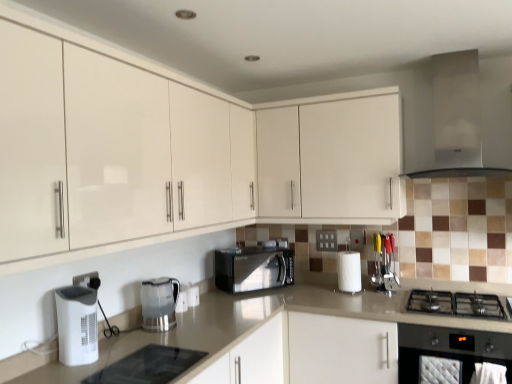
This screenshot has height=384, width=512. What are the coordinates of `satin silver exhaust hood at upper right` in the screenshot? It's located at (458, 114).

What do you see at coordinates (147, 366) in the screenshot? I see `black glass cooktop at lower center, acting as the 1th appliance starting from the bottom` at bounding box center [147, 366].

Describe the element at coordinates (77, 325) in the screenshot. This screenshot has width=512, height=384. I see `white plastic air purifier at lower left, which appears as the 2th kitchen appliance when viewed from the back` at that location.

Describe the element at coordinates (159, 303) in the screenshot. I see `clear plastic kettle at center, arranged as the 1th kitchen appliance when viewed from the right` at that location.

What are the coordinates of `black matte gas stove at lower right` in the screenshot? It's located at (449, 349).

What do you see at coordinates (87, 280) in the screenshot? I see `white plastic electric outlet at lower center, which is the 2th electric outlet in back-to-front order` at bounding box center [87, 280].

The image size is (512, 384). I want to click on satin silver exhaust hood at upper right, so click(458, 114).

Considering the points (157, 374) and (179, 222), which point is behind, point (157, 374) or point (179, 222)?

The point (179, 222) is farther from the camera.

Considering the sizes of black glass cooktop at lower center, the second appliance positioned from the back, and matte white cabinets at center, the 1th cabinetry from the front, in the image, is black glass cooktop at lower center, the second appliance positioned from the back, wider or thinner than matte white cabinets at center, the 1th cabinetry from the front,?

Considering their sizes, black glass cooktop at lower center, the second appliance positioned from the back, looks slimmer than matte white cabinets at center, the 1th cabinetry from the front.

Who is bigger, black glass cooktop at lower center, positioned as the second appliance in top-to-bottom order, or matte white cabinets at center, the 1th cabinetry from the front?

matte white cabinets at center, the 1th cabinetry from the front, is bigger.

In the image, is black glass cooktop at lower center, positioned as the 1th appliance in left-to-right order, positioned in front of or behind matte white cabinets at center, which is counted as the second cabinetry, starting from the back?

black glass cooktop at lower center, positioned as the 1th appliance in left-to-right order, is behind matte white cabinets at center, which is counted as the second cabinetry, starting from the back.

Could you tell me if black glass cooktop at lower center, the second appliance positioned from the back, is turned towards clear plastic kettle at center, arranged as the 1th kitchen appliance when viewed from the right?

No, black glass cooktop at lower center, the second appliance positioned from the back, is not turned towards clear plastic kettle at center, arranged as the 1th kitchen appliance when viewed from the right.

Is black glass cooktop at lower center, marked as the second appliance in a right-to-left arrangement, not inside clear plastic kettle at center, the 2th kitchen appliance when ordered from left to right?

Yes, black glass cooktop at lower center, marked as the second appliance in a right-to-left arrangement, is located beyond the bounds of clear plastic kettle at center, the 2th kitchen appliance when ordered from left to right.

Does black glass cooktop at lower center, marked as the second appliance in a right-to-left arrangement, have a lesser width compared to clear plastic kettle at center, arranged as the 1th kitchen appliance when viewed from the right?

Incorrect, the width of black glass cooktop at lower center, marked as the second appliance in a right-to-left arrangement, is not less than that of clear plastic kettle at center, arranged as the 1th kitchen appliance when viewed from the right.

Is black glass cooktop at lower center, acting as the 1th appliance starting from the bottom, directly adjacent to clear plastic kettle at center, which appears as the 1th kitchen appliance when viewed from the back?

No, black glass cooktop at lower center, acting as the 1th appliance starting from the bottom, is not touching clear plastic kettle at center, which appears as the 1th kitchen appliance when viewed from the back.

From a real-world perspective, which object stands above the other?

From a 3D spatial view, white glossy cabinet at upper center, placed as the second cabinetry when sorted from front to back, is above.

In the scene shown: Considering the sizes of objects black glass cooktop at lower center, the second appliance positioned from the back, and white glossy cabinet at upper center, placed as the second cabinetry when sorted from front to back, in the image provided, who is shorter, black glass cooktop at lower center, the second appliance positioned from the back, or white glossy cabinet at upper center, placed as the second cabinetry when sorted from front to back,?

Standing shorter between the two is black glass cooktop at lower center, the second appliance positioned from the back.

Is black glass cooktop at lower center, positioned as the 1th appliance in left-to-right order, thinner than white glossy cabinet at upper center, placed as the second cabinetry when sorted from front to back?

Indeed, black glass cooktop at lower center, positioned as the 1th appliance in left-to-right order, has a lesser width compared to white glossy cabinet at upper center, placed as the second cabinetry when sorted from front to back.

Which is in front, point (154, 355) or point (335, 109)?

The point (154, 355) is in front.

Can we say black matte microwave at center lies outside beige laminate countertop at center?

No, black matte microwave at center is inside beige laminate countertop at center's boundary.

Is beige laminate countertop at center at the back of black matte microwave at center?

That's not correct — black matte microwave at center is not looking away from beige laminate countertop at center.

Considering the relative sizes of black matte microwave at center and beige laminate countertop at center in the image provided, is black matte microwave at center taller than beige laminate countertop at center?

Incorrect, the height of black matte microwave at center is not larger of that of beige laminate countertop at center.

Can you confirm if black matte microwave at center is thinner than beige laminate countertop at center?

Correct, the width of black matte microwave at center is less than that of beige laminate countertop at center.

Based on their positions, is black matte gas stove at lower right located to the left or right of metallic silver utensils at right, which appears as the 2th appliance when viewed from the left?

Based on their positions, black matte gas stove at lower right is located to the right of metallic silver utensils at right, which appears as the 2th appliance when viewed from the left.

Is black matte gas stove at lower right aimed at metallic silver utensils at right, the second appliance in the bottom-to-top sequence?

No, black matte gas stove at lower right is not facing towards metallic silver utensils at right, the second appliance in the bottom-to-top sequence.

Consider the image. Does black matte gas stove at lower right come behind metallic silver utensils at right, arranged as the 1th appliance when viewed from the top?

That is False.

Can you see black matte gas stove at lower right touching metallic silver utensils at right, arranged as the 1th appliance when viewed from the top?

black matte gas stove at lower right is not next to metallic silver utensils at right, arranged as the 1th appliance when viewed from the top, and they're not touching.

From the image's perspective, which one is positioned higher, white plastic electric outlet at center, the first electric outlet in the back-to-front sequence, or black matte microwave at center?

white plastic electric outlet at center, the first electric outlet in the back-to-front sequence, from the image's perspective.

Considering the relative sizes of white plastic electric outlet at center, which is the first electric outlet from right to left, and black matte microwave at center in the image provided, is white plastic electric outlet at center, which is the first electric outlet from right to left, wider than black matte microwave at center?

No, white plastic electric outlet at center, which is the first electric outlet from right to left, is not wider than black matte microwave at center.

How many degrees apart are the facing directions of white plastic electric outlet at center, the first electric outlet in the back-to-front sequence, and black matte microwave at center?

They differ by 49.8 degrees in their facing directions.

At what (x,y) coordinates should I click in order to perform the action: click on microwave oven located underneath the white plastic electric outlet at center, which is counted as the 2th electric outlet, starting from the left (from a real-world perspective). Please return your answer as a coordinate pair (x, y). The width and height of the screenshot is (512, 384). Looking at the image, I should click on (253, 269).

Could you tell me if white plastic electric outlet at lower center, which is the 2th electric outlet in back-to-front order, is facing matte white cabinets at center, which is counted as the second cabinetry, starting from the back?

No, white plastic electric outlet at lower center, which is the 2th electric outlet in back-to-front order, is not oriented towards matte white cabinets at center, which is counted as the second cabinetry, starting from the back.

Measure the distance from white plastic electric outlet at lower center, the 1th electric outlet from the front, to matte white cabinets at center, which is counted as the second cabinetry, starting from the back.

white plastic electric outlet at lower center, the 1th electric outlet from the front, is 37.82 inches away from matte white cabinets at center, which is counted as the second cabinetry, starting from the back.

Are white plastic electric outlet at lower center, acting as the 1th electric outlet starting from the left, and matte white cabinets at center, the 1th cabinetry from the front, located far from each other?

No, there isn't a large distance between white plastic electric outlet at lower center, acting as the 1th electric outlet starting from the left, and matte white cabinets at center, the 1th cabinetry from the front.

From the image's perspective, count 2nd appliances downward from the matte white cabinets at center, which is counted as the second cabinetry, starting from the back, and point to it. Please provide its 2D coordinates.

[(147, 366)]

Starting from the black glass cooktop at lower center, positioned as the second appliance in top-to-bottom order, which kitchen appliance is the 2nd one behind? Please provide its 2D coordinates.

[(159, 303)]

Looking at this image, from the image, which object appears to be farther from white matte paper towel at center, white plastic air purifier at lower left, which appears as the 2th kitchen appliance when viewed from the back, or matte white cabinets at center, the 1th cabinetry from the front?

Among the two, white plastic air purifier at lower left, which appears as the 2th kitchen appliance when viewed from the back, is located further to white matte paper towel at center.

Which object lies further to the anchor point matte white cabinets at center, the 1th cabinetry from the front, black matte gas stove at lower right or black glass cooktop at lower center, positioned as the second appliance in top-to-bottom order?

black matte gas stove at lower right lies further to matte white cabinets at center, the 1th cabinetry from the front, than the other object.

Estimate the real-world distances between objects in this image. Which object is closer to beige laminate countertop at center, white plastic electric outlet at center, which is the first electric outlet from right to left, or clear plastic kettle at center, which appears as the 1th kitchen appliance when viewed from the back?

white plastic electric outlet at center, which is the first electric outlet from right to left, lies closer to beige laminate countertop at center than the other object.

Looking at the image, which one is located further to white matte paper towel at center, clear plastic kettle at center, the 2th kitchen appliance when ordered from left to right, or white plastic electric outlet at lower center, the 1th electric outlet from the front?

white plastic electric outlet at lower center, the 1th electric outlet from the front, is positioned further to the anchor white matte paper towel at center.

When comparing their distances from white matte paper towel at center, does black glass cooktop at lower center, acting as the 1th appliance starting from the bottom, or clear plastic kettle at center, arranged as the 1th kitchen appliance when viewed from the right, seem further?

Based on the image, black glass cooktop at lower center, acting as the 1th appliance starting from the bottom, appears to be further to white matte paper towel at center.

Which object lies nearer to the anchor point white matte paper towel at center, beige laminate countertop at center or black matte microwave at center?

Based on the image, beige laminate countertop at center appears to be nearer to white matte paper towel at center.

Based on their spatial positions, is white plastic electric outlet at lower center, acting as the 1th electric outlet starting from the left, or beige laminate countertop at center further from satin silver exhaust hood at upper right?

white plastic electric outlet at lower center, acting as the 1th electric outlet starting from the left, is further to satin silver exhaust hood at upper right.

From the image, which object appears to be farther from satin silver exhaust hood at upper right, beige laminate countertop at center or metallic silver utensils at right, acting as the 2th appliance starting from the front?

beige laminate countertop at center.

Locate an element on the screen. This screenshot has height=384, width=512. appliance between white plastic electric outlet at lower center, the 1th electric outlet from the front, and white glossy cabinet at upper center, the first cabinetry from the back is located at coordinates (147, 366).

I want to click on paper towel between black glass cooktop at lower center, marked as the 1th appliance in a front-to-back arrangement, and metallic silver utensils at right, arranged as the 1th appliance when viewed from the top, in the front-back direction, so click(349, 271).

Find the location of a particular element. The image size is (512, 384). microwave oven between beige laminate countertop at center and white matte paper towel at center from front to back is located at coordinates (253, 269).

Find the location of a particular element. exhaust hood positioned between matte white cabinets at center, which is counted as the second cabinetry, starting from the back, and black matte microwave at center from near to far is located at coordinates (458, 114).